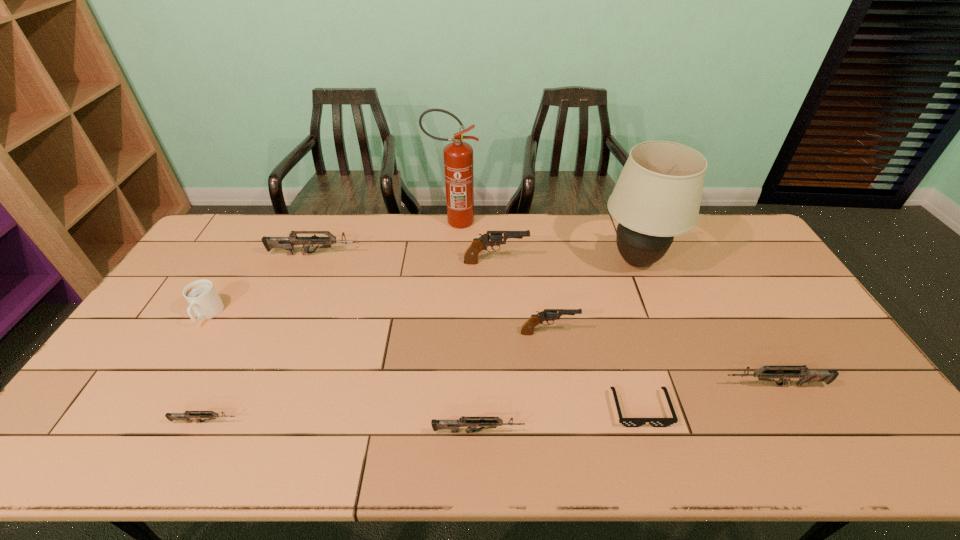
Where is `vacant space at the left edge`? Image resolution: width=960 pixels, height=540 pixels. vacant space at the left edge is located at coordinates (134, 416).

In the image, there is a desktop. At what (x,y) coordinates should I click in order to perform the action: click on free region at the right edge. Please return your answer as a coordinate pair (x, y). The width and height of the screenshot is (960, 540). Looking at the image, I should click on (776, 308).

You are a GUI agent. You are given a task and a screenshot of the screen. Output one action in this format:
    pyautogui.click(x=<x>, y=<y>)
    Task: Click on the free area in between the lampshade and the second nearest gun
    Image resolution: width=960 pixels, height=540 pixels.
    Given the screenshot: What is the action you would take?
    pyautogui.click(x=421, y=341)

Locate an element on the screen. The width and height of the screenshot is (960, 540). empty location between the nearest gun and the lampshade is located at coordinates (557, 346).

Find the location of a particular element. vacant space in between the ninth tallest object and the lampshade is located at coordinates 421,341.

Identify the location of free point between the black sunglasses and the farther black gun. This screenshot has width=960, height=540. [x=568, y=335].

Identify the location of unoccupied position between the shortest object and the third nearest grey gun. (708, 397).

The height and width of the screenshot is (540, 960). In order to click on free space between the sunglasses and the lampshade in this screenshot , I will do `click(638, 335)`.

Locate an element on the screen. Image resolution: width=960 pixels, height=540 pixels. empty space that is in between the fire extinguisher and the nearest grey gun is located at coordinates (466, 327).

Locate an element on the screen. The height and width of the screenshot is (540, 960). free area in between the leftmost object and the fifth nearest object is located at coordinates (378, 324).